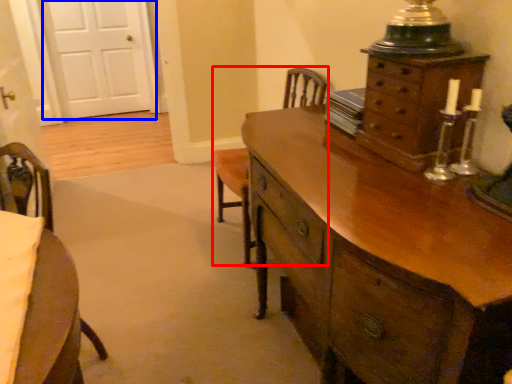
Question: Which object appears farthest to the camera in this image, armchair (highlighted by a red box) or door (highlighted by a blue box)?

Choices:
 (A) armchair
 (B) door

Answer: (B)